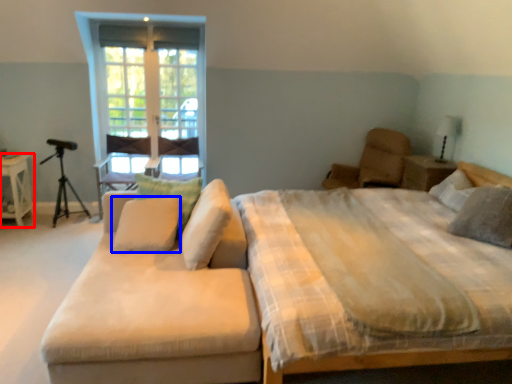
Question: Which point is closer to the camera, nightstand (highlighted by a red box) or pillow (highlighted by a blue box)?

Choices:
 (A) nightstand
 (B) pillow

Answer: (B)